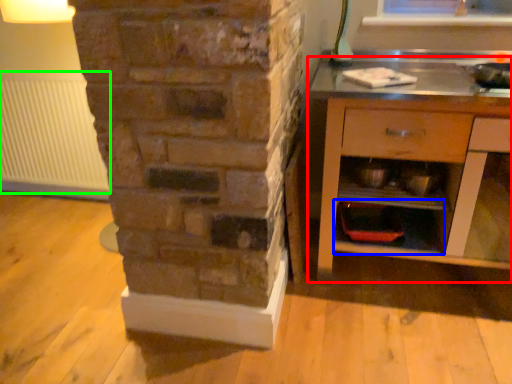
Question: Based on their relative distances, which object is nearer to chest of drawers (highlighted by a red box)? Choose from shelf (highlighted by a blue box) and radiator (highlighted by a green box).

Choices:
 (A) shelf
 (B) radiator

Answer: (A)